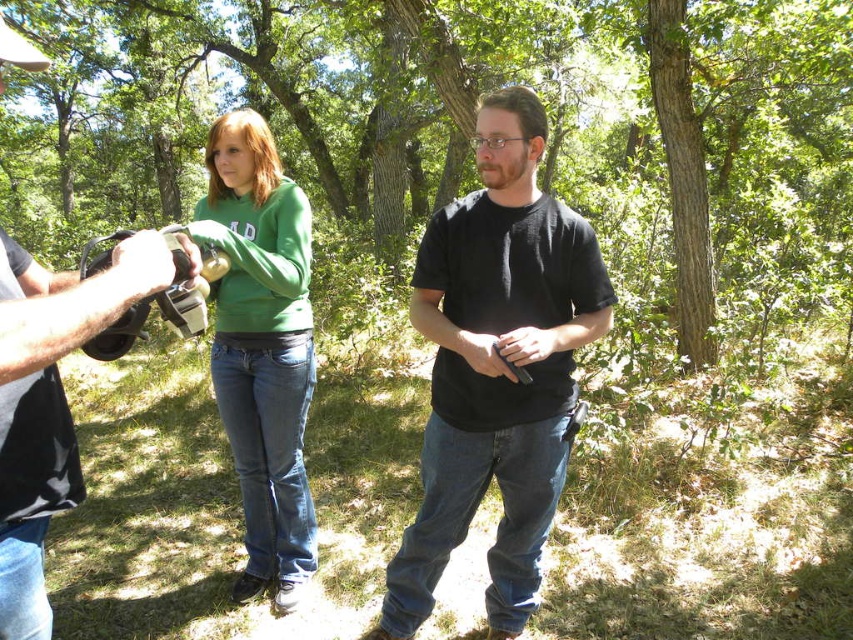
Does point (653, 125) come in front of point (550, 426)?

No.

Which is below, brown textured tree at center or black cotton shirt at center?

black cotton shirt at center is below.

The image size is (853, 640). I want to click on brown textured tree at center, so coord(463,120).

Does black cotton shirt at center have a greater width compared to matte black camera at left?

Indeed, black cotton shirt at center has a greater width compared to matte black camera at left.

Is point (525, 195) behind point (15, 33)?

No, (525, 195) is closer to viewer.

Who is more distant from viewer, (387,604) or (4,547)?

Positioned behind is point (387,604).

This screenshot has width=853, height=640. Find the location of `black cotton shirt at center`. black cotton shirt at center is located at coordinates (497, 368).

Which is behind, point (647, 168) or point (138, 296)?

The point (647, 168) is behind.

Does brown textured tree at center come behind matte black camera at left?

Yes, it is behind matte black camera at left.

Which is in front, point (480, 88) or point (64, 349)?

Positioned in front is point (64, 349).

The image size is (853, 640). Identify the location of brown textured tree at center. (463, 120).